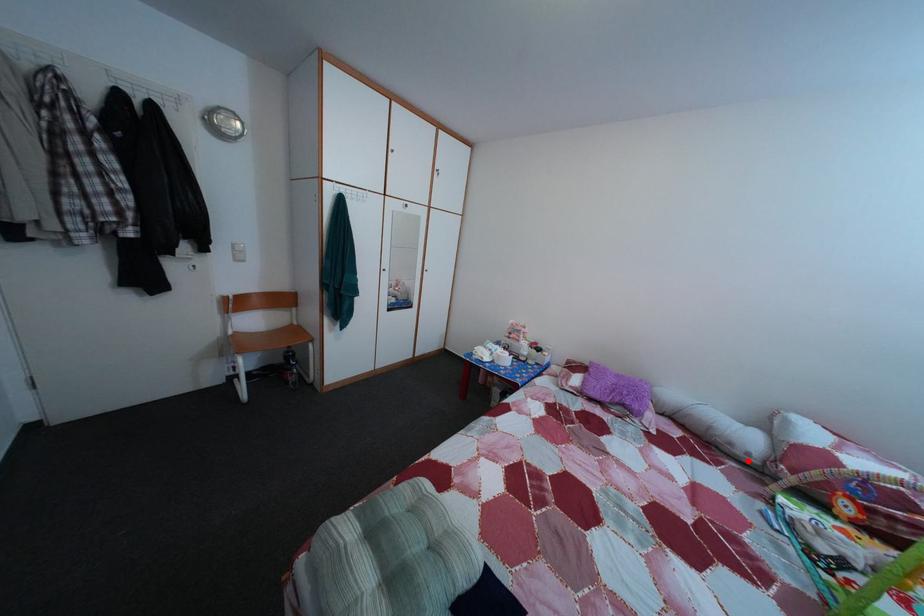
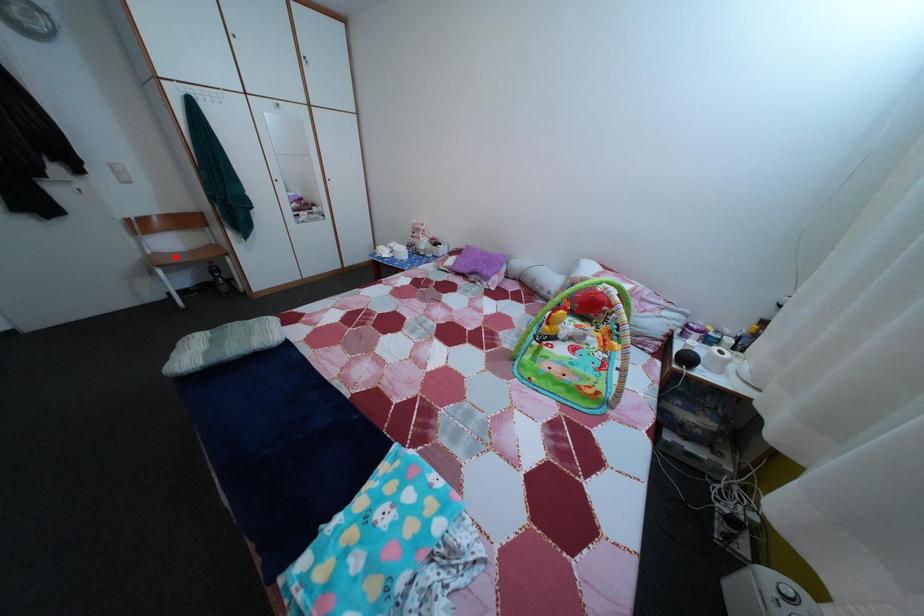
I am providing you with two images of the same scene from different viewpoints. A red point is marked on the first image and another point is marked on the second image. Are the points marked in image1 and image2 representing the same 3D position?

No